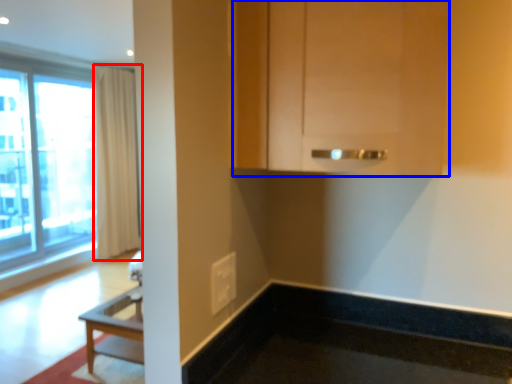
Question: Among these objects, which one is nearest to the camera, curtain (highlighted by a red box) or cabinetry (highlighted by a blue box)?

Choices:
 (A) curtain
 (B) cabinetry

Answer: (B)